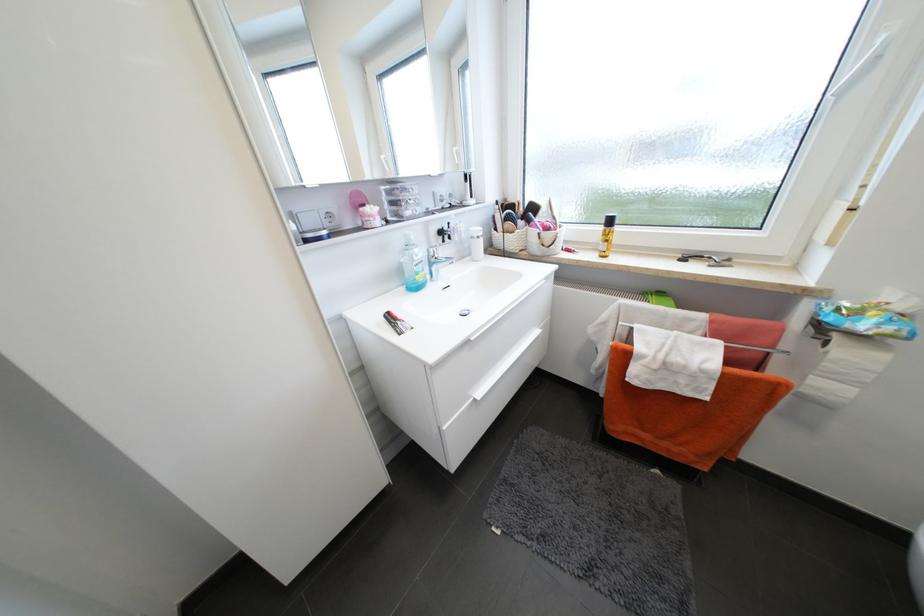
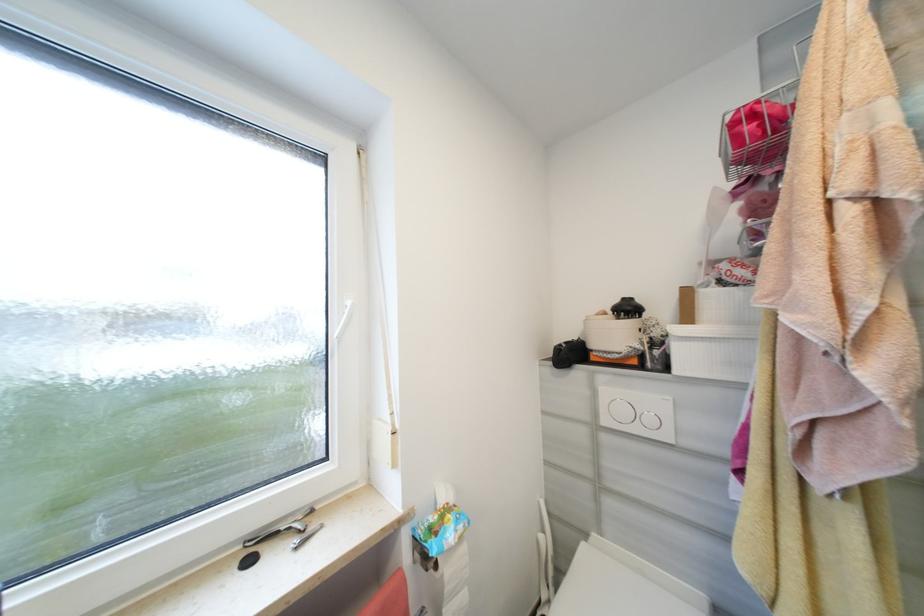
Question: The camera is either moving clockwise (left) or counter-clockwise (right) around the object. The first image is from the beginning of the video and the second image is from the end. Is the camera moving left or right when shooting the video?

Choices:
 (A) Left
 (B) Right

Answer: (A)